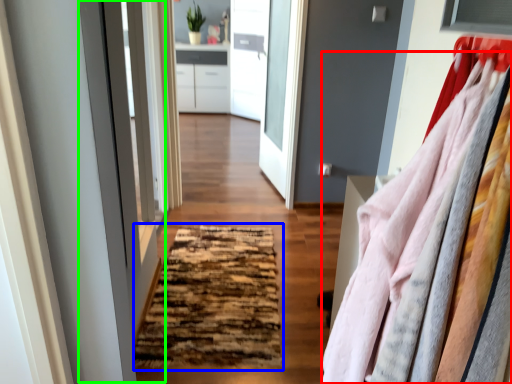
Question: Which object is the closest to the clothing (highlighted by a red box)? Choose among these: mat (highlighted by a blue box) or screen door (highlighted by a green box).

Choices:
 (A) mat
 (B) screen door

Answer: (A)